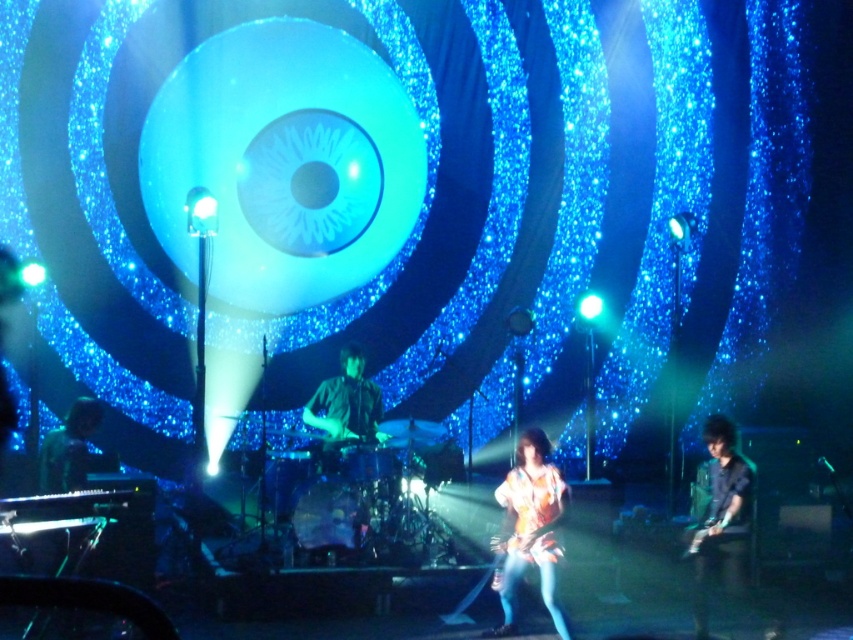
Does dark blue shirt at right have a larger size compared to shiny black guitar at center?

Yes.

Is dark blue shirt at right above shiny black guitar at center?

No, dark blue shirt at right is not above shiny black guitar at center.

The height and width of the screenshot is (640, 853). What do you see at coordinates (722, 518) in the screenshot? I see `dark blue shirt at right` at bounding box center [722, 518].

Where is `dark blue shirt at right`? dark blue shirt at right is located at coordinates (722, 518).

Is shiny black guitar at center to the right of shiny black keyboard at lower left from the viewer's perspective?

Indeed, shiny black guitar at center is positioned on the right side of shiny black keyboard at lower left.

Can you confirm if shiny black guitar at center is shorter than shiny black keyboard at lower left?

No.

Who is more forward, (349, 355) or (62, 440)?

Positioned in front is point (62, 440).

The width and height of the screenshot is (853, 640). Find the location of `shiny black guitar at center`. shiny black guitar at center is located at coordinates (345, 408).

Who is lower down, floral-patterned shirt at center or dark blue shirt at right?

Positioned lower is dark blue shirt at right.

Is point (511, 472) farther from viewer compared to point (732, 548)?

That is False.

At what (x,y) coordinates should I click in order to perform the action: click on floral-patterned shirt at center. Please return your answer as a coordinate pair (x, y). The image size is (853, 640). Looking at the image, I should click on tap(531, 529).